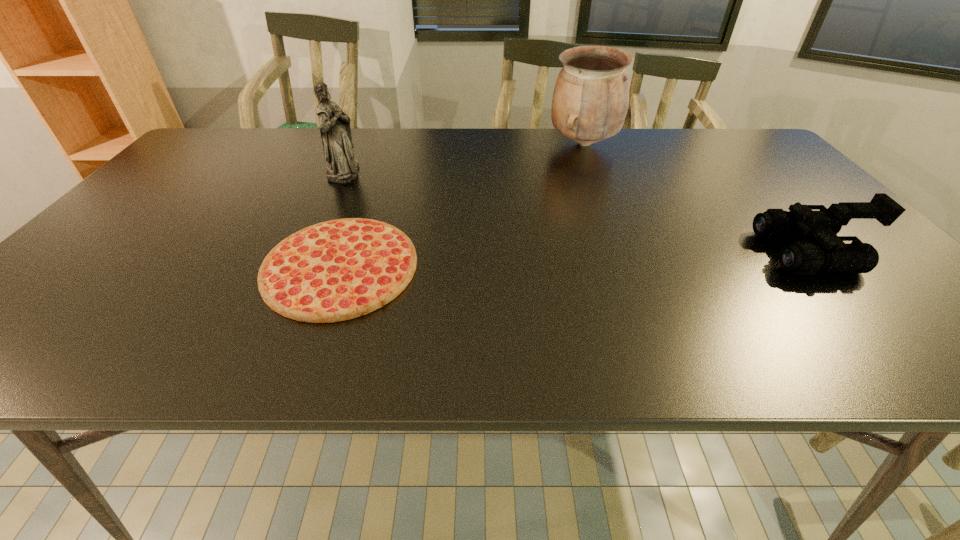
At what (x,y) coordinates should I click in order to perform the action: click on the third object from left to right. Please return your answer as a coordinate pair (x, y). Looking at the image, I should click on (590, 100).

At what (x,y) coordinates should I click in order to perform the action: click on figurine. Please return your answer as a coordinate pair (x, y). Looking at the image, I should click on (335, 130).

The height and width of the screenshot is (540, 960). In order to click on binoculars in this screenshot , I will do `click(833, 255)`.

Find the location of a particular element. This screenshot has height=540, width=960. the third tallest object is located at coordinates (833, 255).

Identify the location of the shortest object. (337, 270).

You are a GUI agent. You are given a task and a screenshot of the screen. Output one action in this format:
    pyautogui.click(x=<x>, y=<y>)
    Task: Click on the free space located 0.290m on the right of the urn
    
    Given the screenshot: What is the action you would take?
    708,144

The height and width of the screenshot is (540, 960). Identify the location of vacant point located on the front-facing side of the figurine. (396, 172).

Locate an element on the screen. The image size is (960, 540). vacant position located on the front lenses of the binoculars is located at coordinates (670, 252).

Where is `vacant space situated on the front lenses of the binoculars`? The image size is (960, 540). vacant space situated on the front lenses of the binoculars is located at coordinates (648, 252).

The width and height of the screenshot is (960, 540). Identify the location of free space located 0.150m on the front lenses of the binoculars. (701, 252).